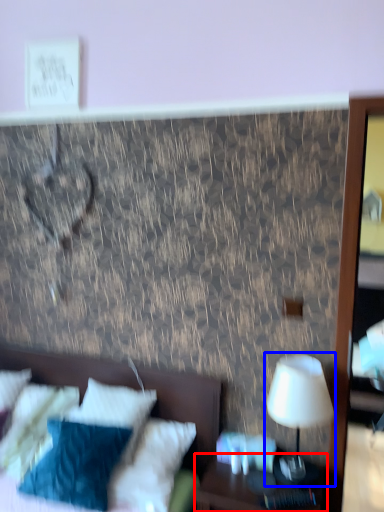
Question: Which point is closer to the camera, nightstand (highlighted by a red box) or table lamp (highlighted by a blue box)?

Choices:
 (A) nightstand
 (B) table lamp

Answer: (A)